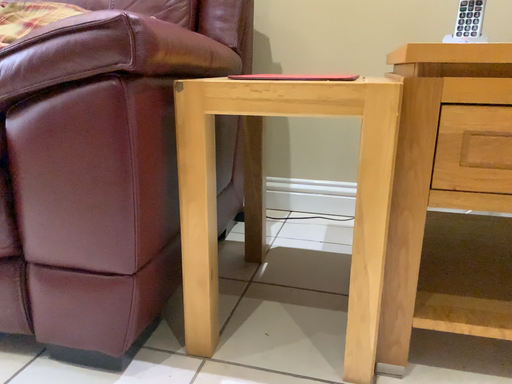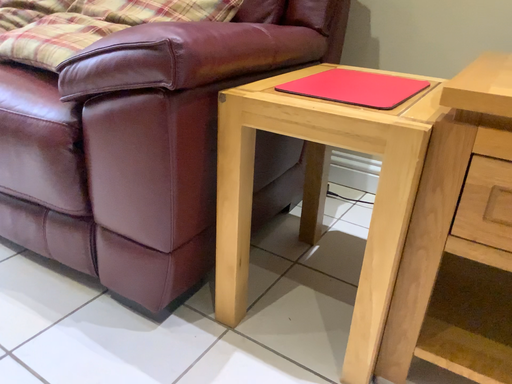
Question: Which way did the camera rotate in the video?

Choices:
 (A) rotated upward
 (B) rotated downward

Answer: (B)